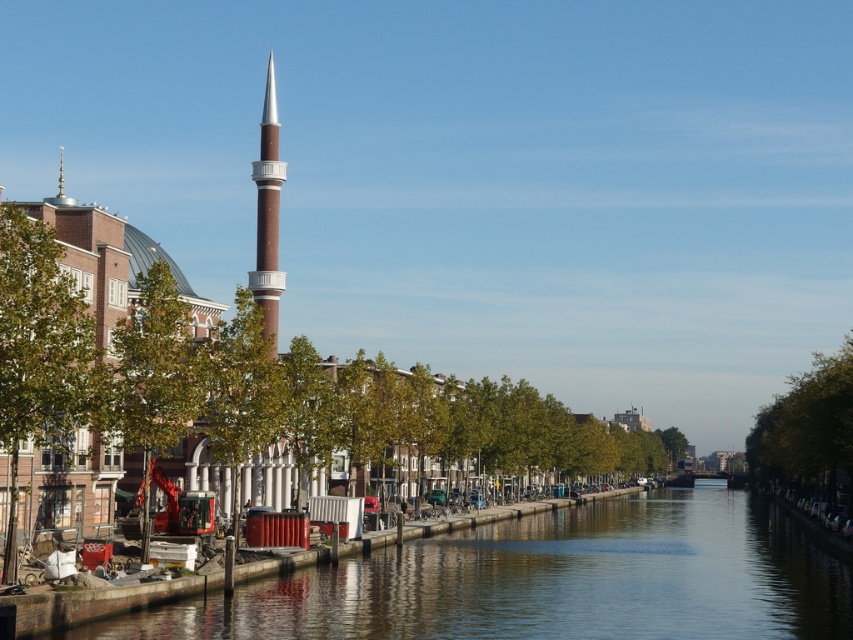
Who is shorter, smooth concrete canal at lower left or brown glossy minaret at center?

Standing shorter between the two is smooth concrete canal at lower left.

Identify the location of smooth concrete canal at lower left. (544, 580).

This screenshot has width=853, height=640. In order to click on smooth concrete canal at lower left in this screenshot , I will do `click(544, 580)`.